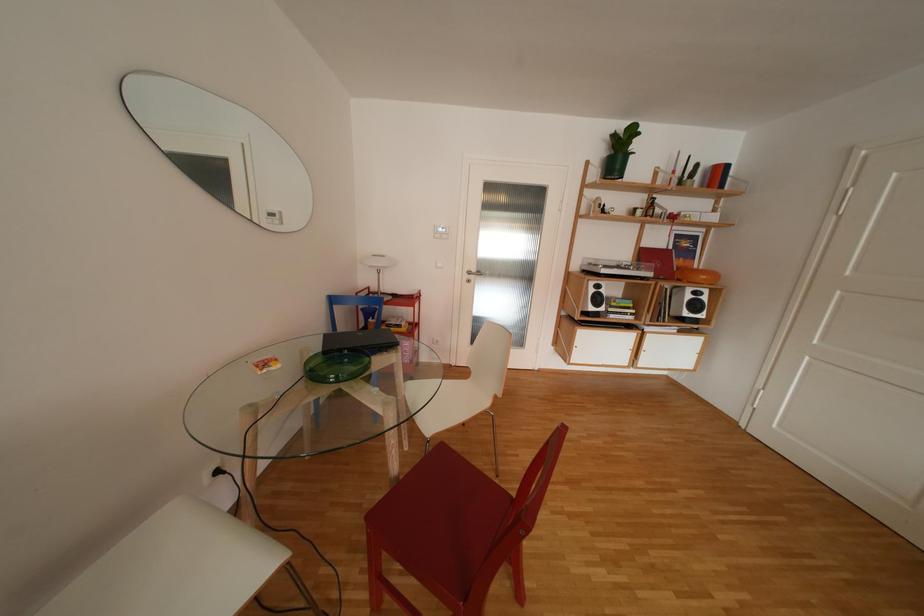
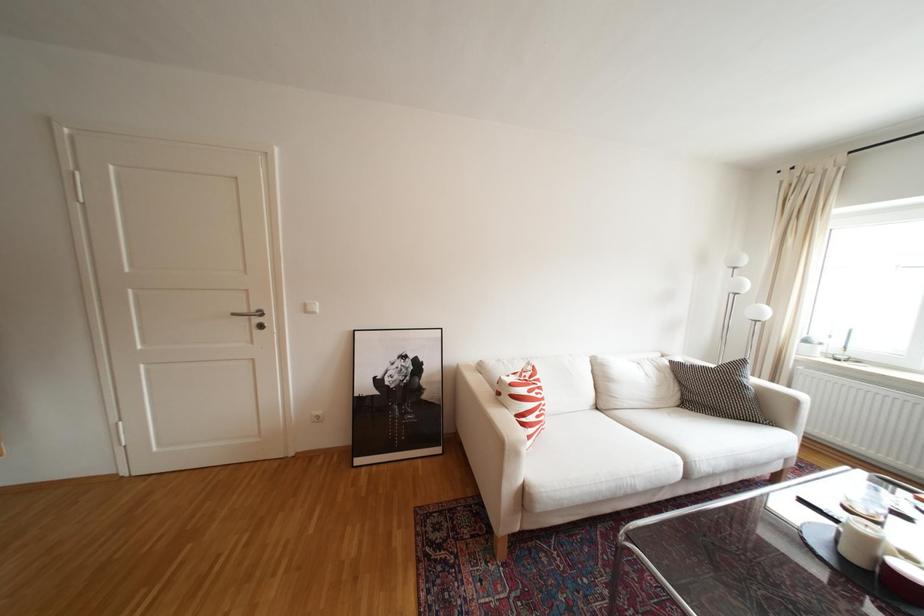
Question: How did the camera likely rotate?

Choices:
 (A) Left
 (B) Right
 (C) Up
 (D) Down

Answer: (B)